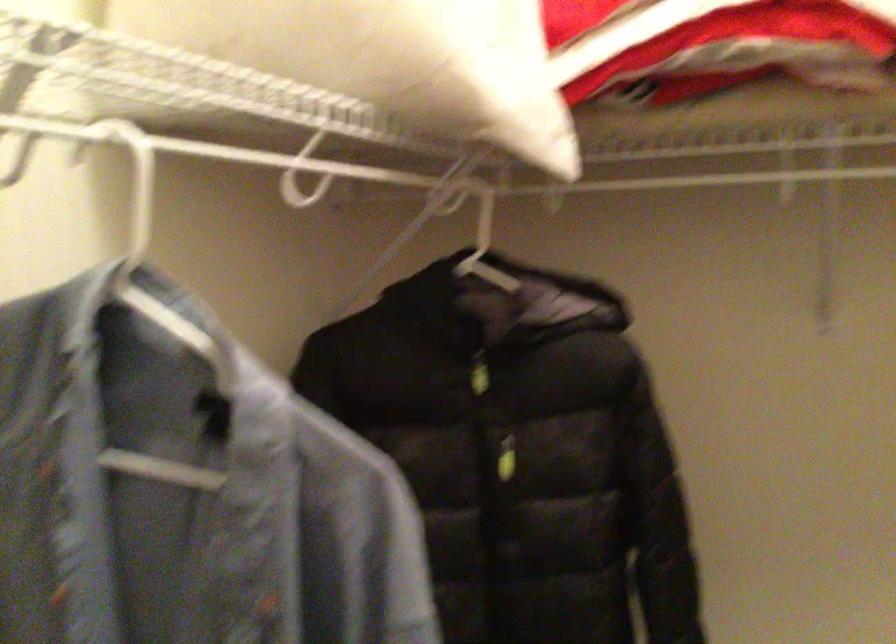
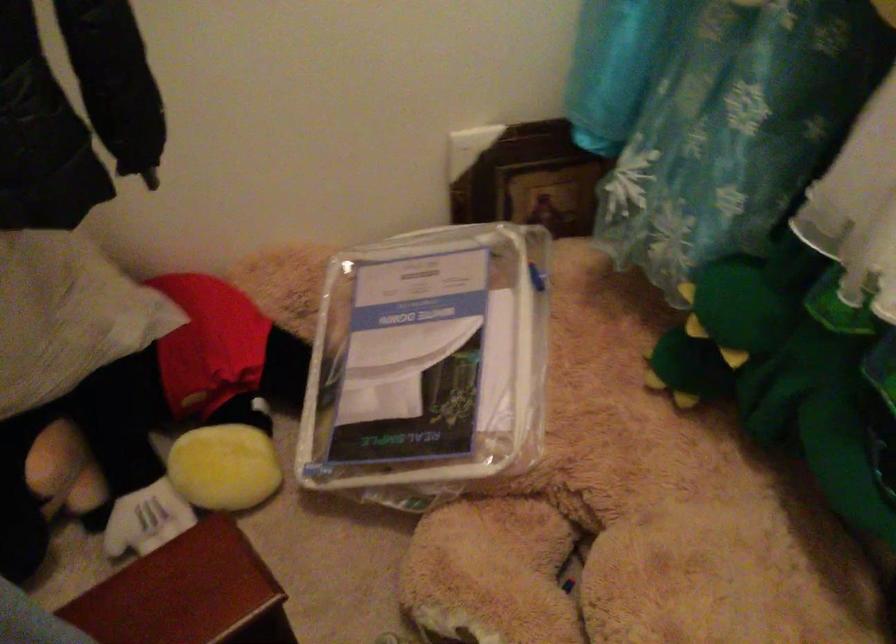
The first image is from the beginning of the video and the second image is from the end. How did the camera likely rotate when shooting the video?

The camera rotated toward right-down.